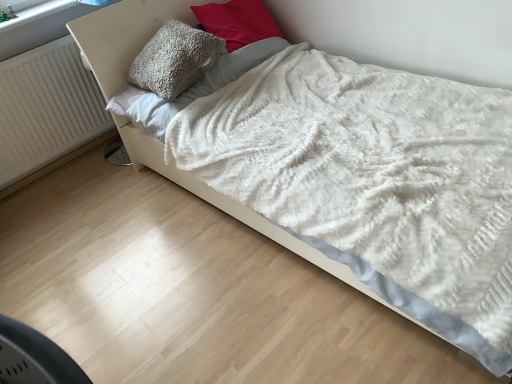
The height and width of the screenshot is (384, 512). I want to click on free point above white ribbed radiator at left (from a real-world perspective), so pyautogui.click(x=27, y=51).